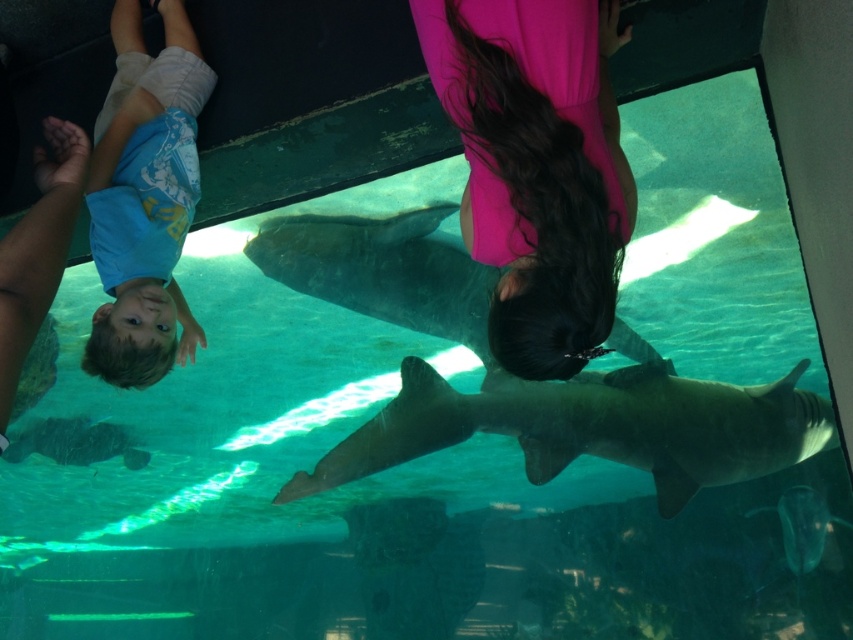
Is point (543, 216) more distant than point (728, 435)?

No, it is in front of (728, 435).

Based on the photo, who is higher up, pink fabric at center or smooth gray shark at center?

Positioned higher is pink fabric at center.

Describe the element at coordinates (537, 166) in the screenshot. I see `pink fabric at center` at that location.

The height and width of the screenshot is (640, 853). In order to click on pink fabric at center in this screenshot , I will do `click(537, 166)`.

Which of these two, pink fabric at center or blue cotton shirt at upper left, stands taller?

blue cotton shirt at upper left is taller.

Can you confirm if pink fabric at center is positioned to the right of blue cotton shirt at upper left?

Indeed, pink fabric at center is positioned on the right side of blue cotton shirt at upper left.

Between point (587, 99) and point (201, 72), which one is positioned in front?

Point (587, 99)

The height and width of the screenshot is (640, 853). Identify the location of pink fabric at center. (537, 166).

Who is more distant from viewer, (741,467) or (132,305)?

Positioned behind is point (741,467).

The image size is (853, 640). I want to click on smooth gray shark at center, so click(x=593, y=428).